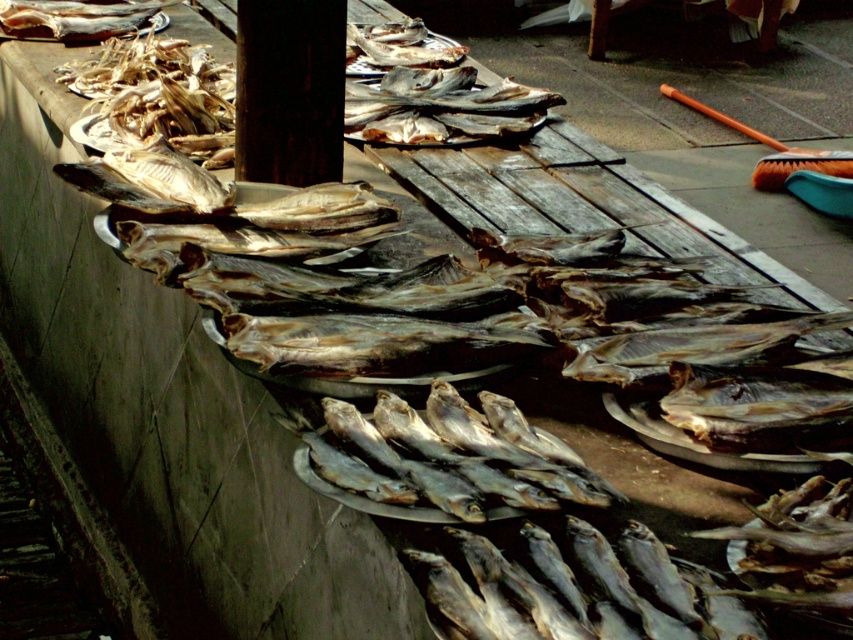
Does dried silver fish at center come in front of shiny silver fish at upper left?

Yes, it is.

Is point (328, 364) in front of point (105, 10)?

Yes, it is.

From the picture: Who is more forward, (x=380, y=342) or (x=6, y=33)?

Positioned in front is point (x=380, y=342).

I want to click on dried silver fish at center, so click(373, 342).